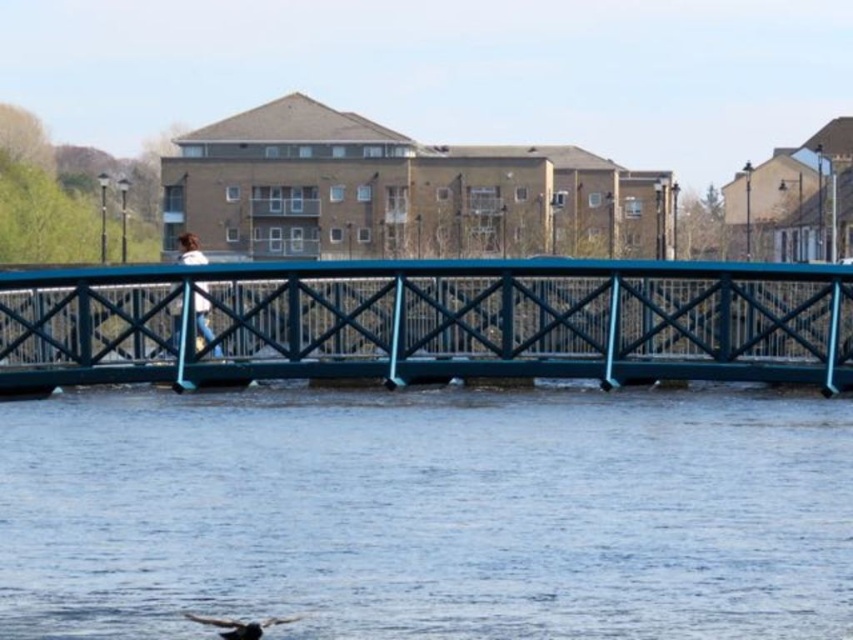
Which of these two, blue water at center or metallic blue pedestrian bridge at center, stands taller?

Standing taller between the two is blue water at center.

Does point (334, 515) lie in front of point (595, 276)?

Yes, point (334, 515) is closer to viewer.

Is point (386, 426) closer to camera compared to point (822, 378)?

Yes, it is in front of point (822, 378).

The height and width of the screenshot is (640, 853). In order to click on blue water at center in this screenshot , I will do `click(428, 513)`.

Who is higher up, blue water at center or white matte jacket at center?

white matte jacket at center is above.

Is blue water at center above white matte jacket at center?

No, blue water at center is not above white matte jacket at center.

Who is more forward, (234, 417) or (199, 324)?

Point (234, 417)

Locate an element on the screen. The width and height of the screenshot is (853, 640). blue water at center is located at coordinates (428, 513).

Which is behind, point (838, 340) or point (171, 308)?

The point (171, 308) is behind.

Is point (166, 282) closer to viewer compared to point (195, 282)?

That is False.

Where is `metallic blue pedestrian bridge at center`? The image size is (853, 640). metallic blue pedestrian bridge at center is located at coordinates tap(432, 321).